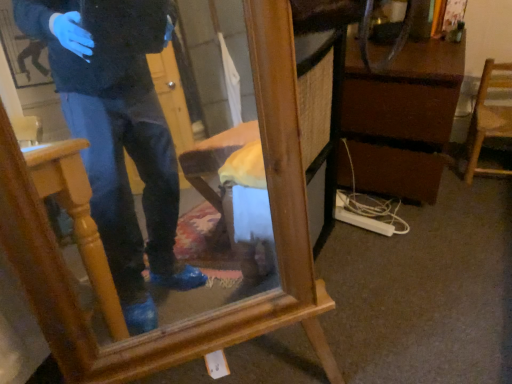
Identify the location of wooden chair at right. This screenshot has width=512, height=384. (488, 119).

At what (x,y) coordinates should I click in order to perform the action: click on wooden chair at right. Please return your answer as a coordinate pair (x, y). Looking at the image, I should click on (488, 119).

Considering the relative sizes of wooden mirror at center and wooden chair at right in the image provided, is wooden mirror at center thinner than wooden chair at right?

No, wooden mirror at center is not thinner than wooden chair at right.

How many degrees apart are the facing directions of wooden mirror at center and wooden chair at right?

36 degrees separate the facing orientations of wooden mirror at center and wooden chair at right.

Is wooden mirror at center further to the viewer compared to wooden chair at right?

No, wooden mirror at center is closer to the camera.

From the image's perspective, is wooden mirror at center on wooden chair at right?

No, from the image's perspective, wooden mirror at center is not above wooden chair at right.

Is the surface of brown wood vanity at center right in direct contact with wooden mirror at center?

No.

Can you tell me how much brown wood vanity at center right and wooden mirror at center differ in facing direction?

The angular difference between brown wood vanity at center right and wooden mirror at center is 41.4 degrees.

From a real-world perspective, between brown wood vanity at center right and wooden mirror at center, who is vertically higher?

In real-world perspective, wooden mirror at center is above.

Which is more to the left, brown wood vanity at center right or wooden mirror at center?

wooden mirror at center is more to the left.

Image resolution: width=512 pixels, height=384 pixels. Find the location of `vanity on the left side of wooden chair at right`. vanity on the left side of wooden chair at right is located at coordinates (402, 118).

Does wooden chair at right turn towards brown wood vanity at center right?

No, wooden chair at right is not turned towards brown wood vanity at center right.

Is wooden chair at right bigger than brown wood vanity at center right?

Incorrect, wooden chair at right is not larger than brown wood vanity at center right.

Which object is further away from the camera, wooden chair at right or brown wood vanity at center right?

wooden chair at right.

How much distance is there between wooden mirror at center and brown wood vanity at center right?

A distance of 88.67 centimeters exists between wooden mirror at center and brown wood vanity at center right.

Does wooden mirror at center have a greater width compared to brown wood vanity at center right?

Incorrect, the width of wooden mirror at center does not surpass that of brown wood vanity at center right.

Between wooden mirror at center and brown wood vanity at center right, which one has more height?

Standing taller between the two is wooden mirror at center.

From a real-world perspective, is wooden mirror at center positioned above or below brown wood vanity at center right?

→ wooden mirror at center is situated higher than brown wood vanity at center right in the real world.

Is brown wood vanity at center right in front of or behind wooden chair at right in the image?

Clearly, brown wood vanity at center right is in front of wooden chair at right.

Based on the photo, considering the relative sizes of brown wood vanity at center right and wooden chair at right in the image provided, is brown wood vanity at center right smaller than wooden chair at right?

Incorrect, brown wood vanity at center right is not smaller in size than wooden chair at right.

Considering the sizes of brown wood vanity at center right and wooden chair at right in the image, is brown wood vanity at center right wider or thinner than wooden chair at right?

brown wood vanity at center right is wider than wooden chair at right.

Is wooden chair at right with wooden mirror at center?

wooden chair at right and wooden mirror at center are clearly separated.

Looking at the image, does wooden chair at right seem bigger or smaller compared to wooden mirror at center?

Clearly, wooden chair at right is smaller in size than wooden mirror at center.

Is wooden chair at right wider than wooden mirror at center?

Incorrect, the width of wooden chair at right does not surpass that of wooden mirror at center.

Between wooden chair at right and wooden mirror at center, which one has more height?

With more height is wooden mirror at center.

Identify the location of chair below the wooden mirror at center (from a real-world perspective). The image size is (512, 384). (488, 119).

The width and height of the screenshot is (512, 384). In the image, there is a brown wood vanity at center right. What are the coordinates of `furniture below it (from the image's perspective)` in the screenshot? It's located at (212, 310).

Based on their spatial positions, is brown wood vanity at center right or wooden chair at right closer to wooden mirror at center?

brown wood vanity at center right.

When comparing their distances from brown wood vanity at center right, does wooden mirror at center or wooden chair at right seem closer?

wooden chair at right.

Which object lies further to the anchor point wooden chair at right, wooden mirror at center or brown wood vanity at center right?

wooden mirror at center.

From the image, which object appears to be nearer to wooden mirror at center, wooden chair at right or brown wood vanity at center right?

Based on the image, brown wood vanity at center right appears to be nearer to wooden mirror at center.

Based on their spatial positions, is brown wood vanity at center right or wooden mirror at center further from wooden chair at right?

Among the two, wooden mirror at center is located further to wooden chair at right.

Estimate the real-world distances between objects in this image. Which object is further from brown wood vanity at center right, wooden chair at right or wooden mirror at center?

The object further to brown wood vanity at center right is wooden mirror at center.

You are a GUI agent. You are given a task and a screenshot of the screen. Output one action in this format:
    pyautogui.click(x=<x>, y=<y>)
    Task: Click on the vanity between wooden mirror at center and wooden chair at right along the z-axis
    
    Given the screenshot: What is the action you would take?
    pyautogui.click(x=402, y=118)